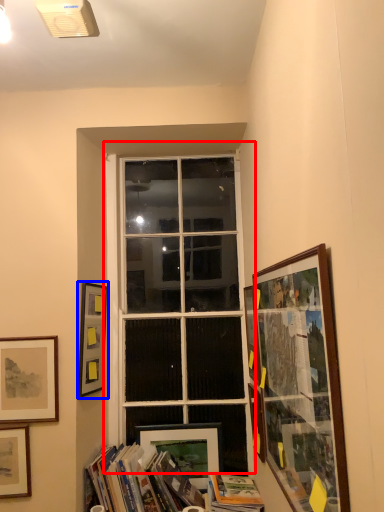
Question: Which of the following is the farthest to the observer, window (highlighted by a red box) or picture frame (highlighted by a blue box)?

Choices:
 (A) window
 (B) picture frame

Answer: (A)